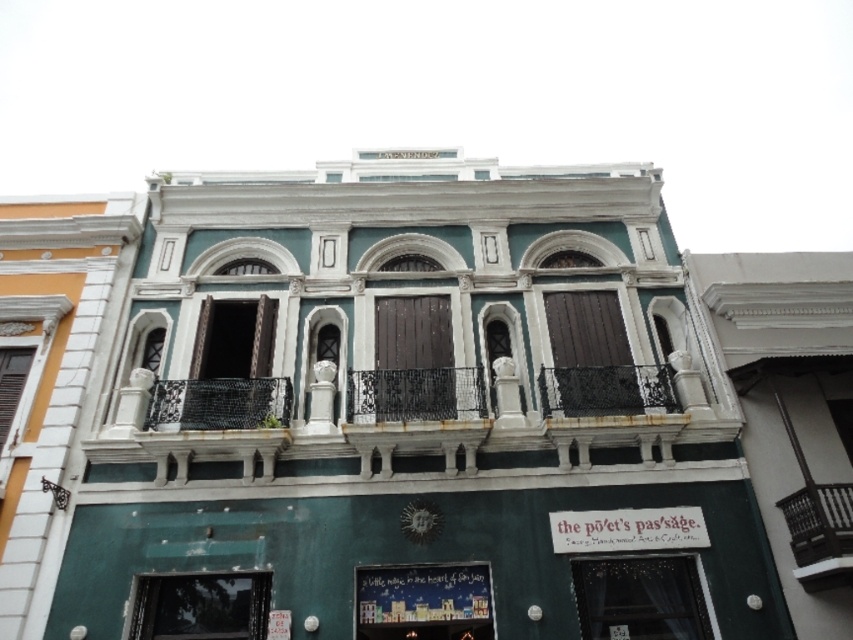
Question: Which object is the farthest from the black mesh curtain at lower center?

Choices:
 (A) matte glass window at lower center
 (B) dark brown wrought iron balcony at center
 (C) matte glass window at lower left

Answer: (C)

Question: Considering the relative positions of matte glass window at lower left and dark brown wrought iron balcony at center in the image provided, where is matte glass window at lower left located with respect to dark brown wrought iron balcony at center?

Choices:
 (A) left
 (B) right

Answer: (A)

Question: Among these points, which one is farthest from the camera?

Choices:
 (A) (242, 614)
 (B) (677, 618)

Answer: (B)

Question: Does white stone balcony at center appear under dark brown wrought iron balcony at center?

Choices:
 (A) no
 (B) yes

Answer: (A)

Question: Does matte glass window at lower center have a lesser width compared to matte white window at lower left?

Choices:
 (A) yes
 (B) no

Answer: (B)

Question: Which point is closer to the camera taking this photo?

Choices:
 (A) (239, 605)
 (B) (4, 428)
 (C) (223, 448)
 (D) (798, 572)

Answer: (D)